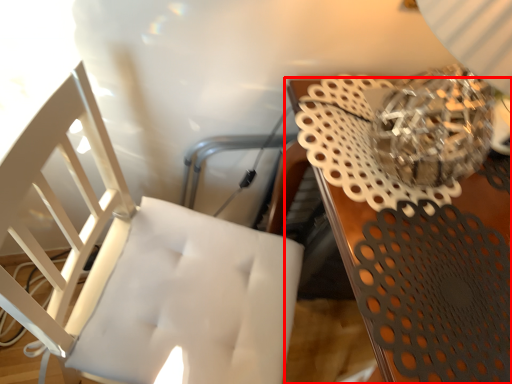
Question: From the image's perspective, where is table (annotated by the red box) located in relation to chair in the image?

Choices:
 (A) below
 (B) above

Answer: (B)